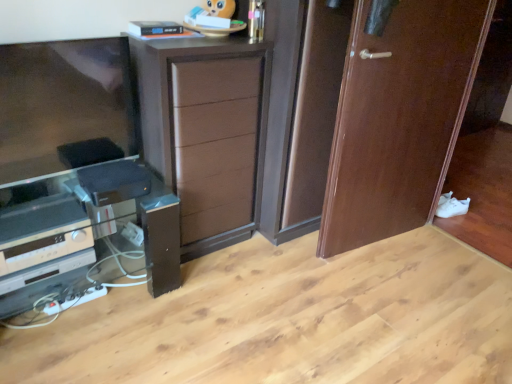
I want to click on vacant space to the right of wooden door at right, so click(x=442, y=257).